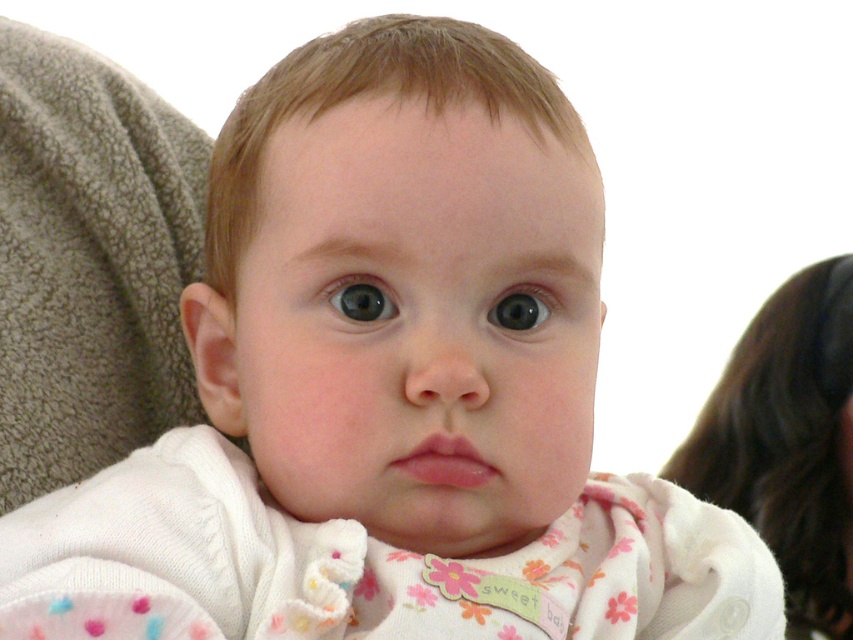
What are the coordinates of `white soft fabric at upper right` in the screenshot? It's located at (788, 442).

Which is in front, point (724, 387) or point (500, 310)?

Positioned in front is point (500, 310).

This screenshot has width=853, height=640. I want to click on white soft fabric at upper right, so click(788, 442).

Who is positioned more to the left, blue glossy eye at center or shiny black eye at center?

blue glossy eye at center

Where is `blue glossy eye at center`? The height and width of the screenshot is (640, 853). blue glossy eye at center is located at coordinates (361, 300).

Locate an element on the screen. blue glossy eye at center is located at coordinates (361, 300).

Based on the photo, is white soft fabric at upper right smaller than blue glossy eye at center?

No.

Is white soft fabric at upper right further to camera compared to blue glossy eye at center?

Yes, it is behind blue glossy eye at center.

Between point (822, 269) and point (341, 300), which one is positioned in front?

Point (341, 300)

Image resolution: width=853 pixels, height=640 pixels. What are the coordinates of `white soft fabric at upper right` in the screenshot? It's located at (788, 442).